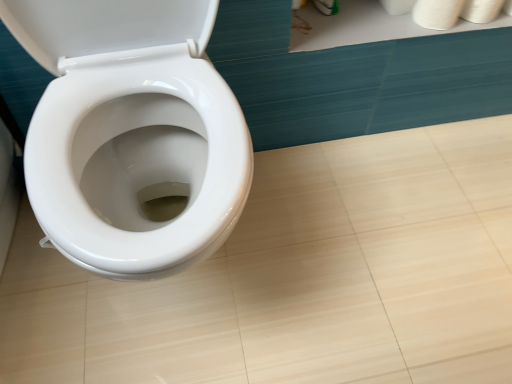
Question: Is white matte toilet paper at upper right, the 1th toilet paper when ordered from left to right, in front of white matte toilet paper at upper right, the 3th toilet paper positioned from the left?

Choices:
 (A) yes
 (B) no

Answer: (B)

Question: From the image's perspective, is white matte toilet paper at upper right, the 1th toilet paper when ordered from left to right, on top of white matte toilet paper at upper right, the 3th toilet paper positioned from the left?

Choices:
 (A) no
 (B) yes

Answer: (B)

Question: Is white matte toilet paper at upper right, acting as the 1th toilet paper starting from the right, surrounded by white matte toilet paper at upper right, the third toilet paper viewed from the right?

Choices:
 (A) yes
 (B) no

Answer: (B)

Question: Is white matte toilet paper at upper right, the third toilet paper viewed from the right, facing away from white matte toilet paper at upper right, the 3th toilet paper positioned from the left?

Choices:
 (A) no
 (B) yes

Answer: (A)

Question: Can you confirm if white matte toilet paper at upper right, the third toilet paper viewed from the right, is wider than white matte toilet paper at upper right, the 3th toilet paper positioned from the left?

Choices:
 (A) yes
 (B) no

Answer: (A)

Question: Considering the relative positions of white matte toilet paper at upper right, the 1th toilet paper when ordered from left to right, and white matte toilet paper at upper right, acting as the 1th toilet paper starting from the right, in the image provided, is white matte toilet paper at upper right, the 1th toilet paper when ordered from left to right, behind white matte toilet paper at upper right, acting as the 1th toilet paper starting from the right,?

Choices:
 (A) no
 (B) yes

Answer: (B)

Question: From a real-world perspective, is white matte toilet paper at upper right, marked as the second toilet paper in a right-to-left arrangement, on top of white matte toilet paper at upper right, the third toilet paper viewed from the right?

Choices:
 (A) yes
 (B) no

Answer: (A)

Question: Does white matte toilet paper at upper right, marked as the second toilet paper in a right-to-left arrangement, lie in front of white matte toilet paper at upper right, the third toilet paper viewed from the right?

Choices:
 (A) no
 (B) yes

Answer: (B)

Question: Is white matte toilet paper at upper right, the 2th toilet paper viewed from the left, positioned beyond the bounds of white matte toilet paper at upper right, the third toilet paper viewed from the right?

Choices:
 (A) yes
 (B) no

Answer: (A)

Question: Is white matte toilet paper at upper right, the 2th toilet paper viewed from the left, further to the viewer compared to white matte toilet paper at upper right, the 1th toilet paper when ordered from left to right?

Choices:
 (A) yes
 (B) no

Answer: (B)

Question: Is white matte toilet paper at upper right, marked as the second toilet paper in a right-to-left arrangement, not near white matte toilet paper at upper right, the third toilet paper viewed from the right?

Choices:
 (A) yes
 (B) no

Answer: (B)

Question: Is white matte toilet paper at upper right, marked as the second toilet paper in a right-to-left arrangement, surrounding white matte toilet paper at upper right, the 1th toilet paper when ordered from left to right?

Choices:
 (A) no
 (B) yes

Answer: (A)

Question: From a real-world perspective, is white matte toilet paper at upper right, the 1th toilet paper when ordered from left to right, under white matte toilet paper at upper right, the 2th toilet paper viewed from the left?

Choices:
 (A) yes
 (B) no

Answer: (A)